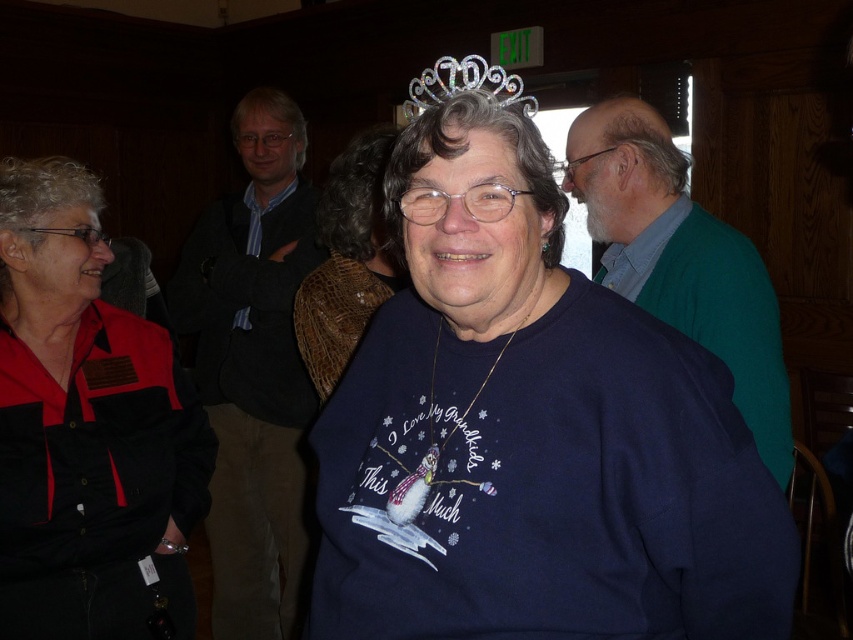
You are a photographer who wants to capture a closeup of the clear plastic tiara at upper center without the black fabric shirt at center appearing in the shot. Is this possible given their positions?

The black fabric shirt at center is positioned under the clear plastic tiara at upper center, so moving the camera angle slightly upward might allow focusing on the tiara without the shirt being visible.